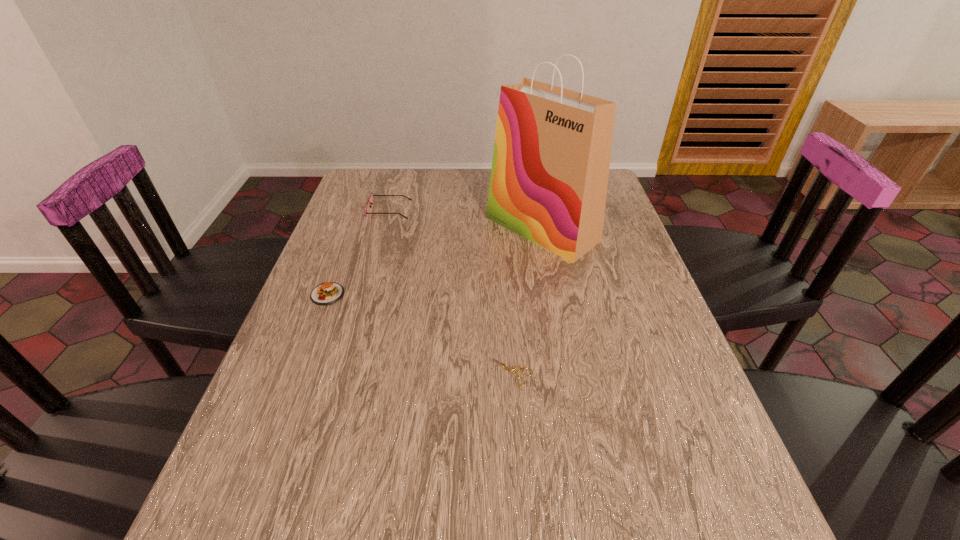
You are a GUI agent. You are given a task and a screenshot of the screen. Output one action in this format:
    pyautogui.click(x=<x>, y=<y>)
    Task: Click on the free space in the image that satisfies the following two spatial constraints: 1. on the front side of the third tallest object; 2. on the left side of the shortest object
    This screenshot has height=540, width=960.
    Given the screenshot: What is the action you would take?
    pyautogui.click(x=298, y=372)